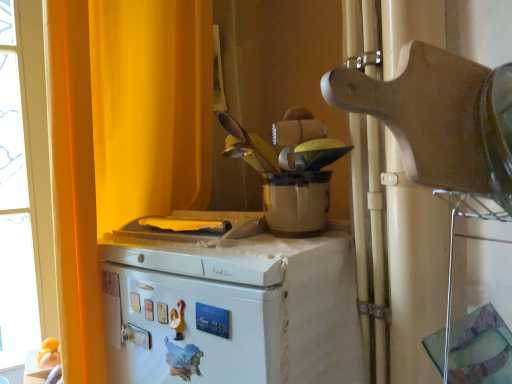
Question: Looking at their shapes, would you say white matte refrigerator at center is wider or thinner than matte white pot at center, marked as the 2th appliance in a front-to-back arrangement?

Choices:
 (A) thin
 (B) wide

Answer: (B)

Question: Is point (314, 311) positioned closer to the camera than point (269, 221)?

Choices:
 (A) closer
 (B) farther

Answer: (A)

Question: Based on their relative distances, which object is nearer to the white matte refrigerator at center?

Choices:
 (A) matte white pot at center, marked as the 2th appliance in a front-to-back arrangement
 (B) wooden cutting board at upper right, arranged as the first appliance when viewed from the front
 (C) yellow fabric curtain at upper left

Answer: (A)

Question: Which object is the farthest from the wooden cutting board at upper right, the second appliance from the back?

Choices:
 (A) yellow fabric curtain at upper left
 (B) white matte refrigerator at center
 (C) matte white pot at center, marked as the 2th appliance in a front-to-back arrangement

Answer: (A)